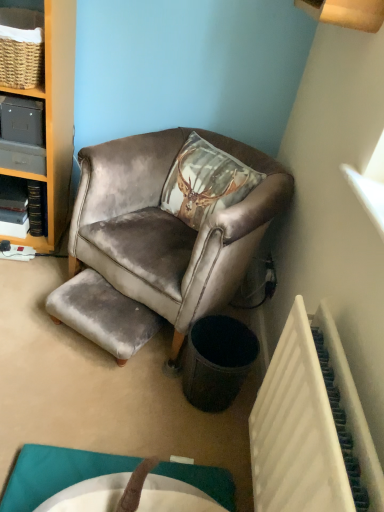
Find the location of a particular element. free region on the left part of velvet grey stool at lower left is located at coordinates (31, 313).